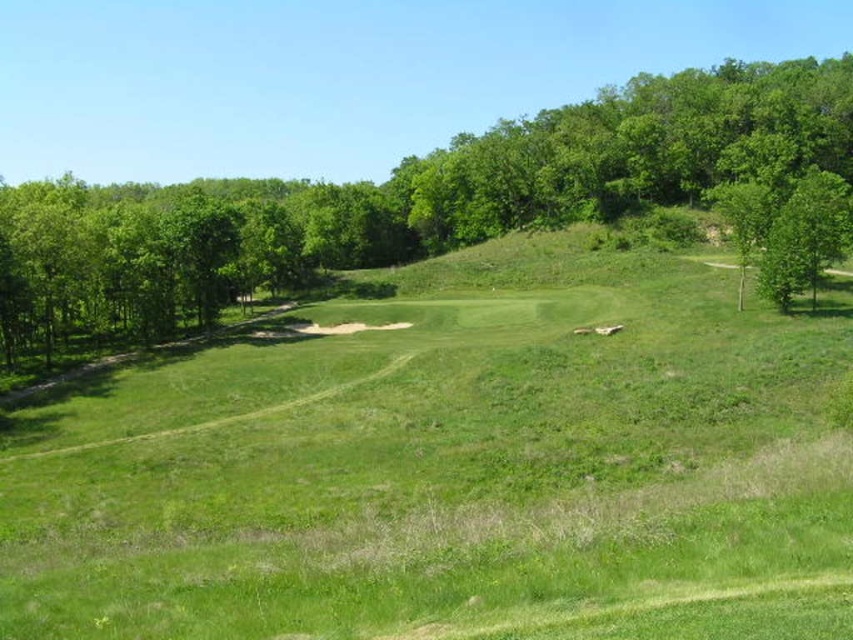
You are standing on the golf course and want to walk from the green grassy field at center to the green leafy tree at right. Which direction should you head to move away from the sand trap?

To move away from the sand trap, you should head towards the green leafy tree at right. Since the green grassy field at center is closer to the viewer than the green leafy tree at right, the sand trap is likely between them. Moving toward the tree would take you away from the sand trap.

You are a golfer standing on the tee box and see the green leafy tree at upper left and the green leafy tree at right in the background. Which tree is positioned higher in the image?

The green leafy tree at upper left is positioned higher in the image than the green leafy tree at right.

From the picture: You are a golfer standing at the point labeled as point (453, 470) on the golf course. You want to hit your ball towards the sand trap in the midground. Is the sand trap located behind or in front of your current position?

The sand trap in the midground is located behind your current position at point (453, 470) because the sand trap is part of the midground, which is further away from the observer than the foreground where you are standing.